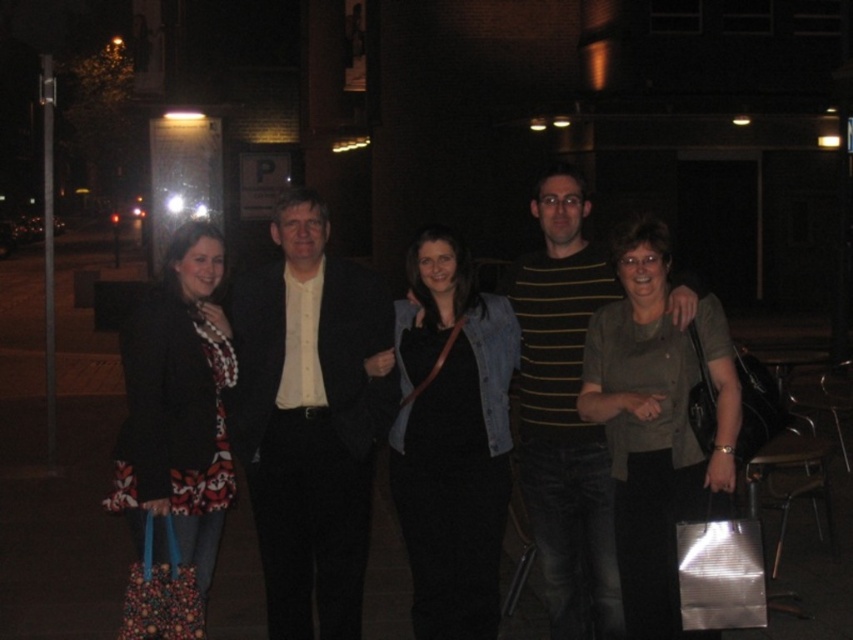
You are standing at the center of the image and want to walk towards the two points labeled point (x=640, y=552) and point (x=552, y=588). Which point should you walk towards if you want to reach the one that is closer to you?

You should walk towards point (x=640, y=552) because it is closer to the viewer than point (x=552, y=588).

You are a photographer trying to capture a group photo of the matte black suit at center and the floral fabric bag at left. Since you want the subjects to be centered in the frame, which object should you move to the left to achieve this?

The floral fabric bag at left should be moved to the left because the matte black suit at center is positioned on the right side of it, so shifting the bag left would allow both objects to be centered in the frame.

You are a photographer trying to capture the matte black suit at center in the image. Based on the coordinates provided, where should you aim your camera?

The matte black suit at center is located at coordinates point (310, 419).